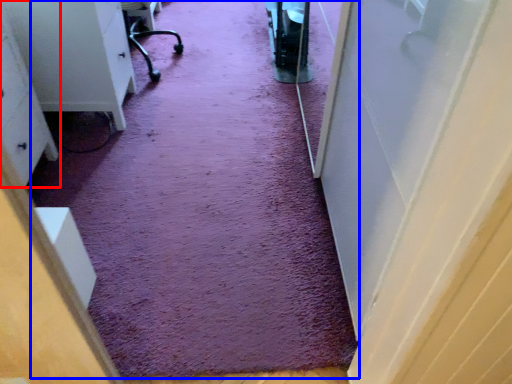
Question: Among these objects, which one is nearest to the camera, furniture (highlighted by a red box) or doormat (highlighted by a blue box)?

Choices:
 (A) furniture
 (B) doormat

Answer: (A)